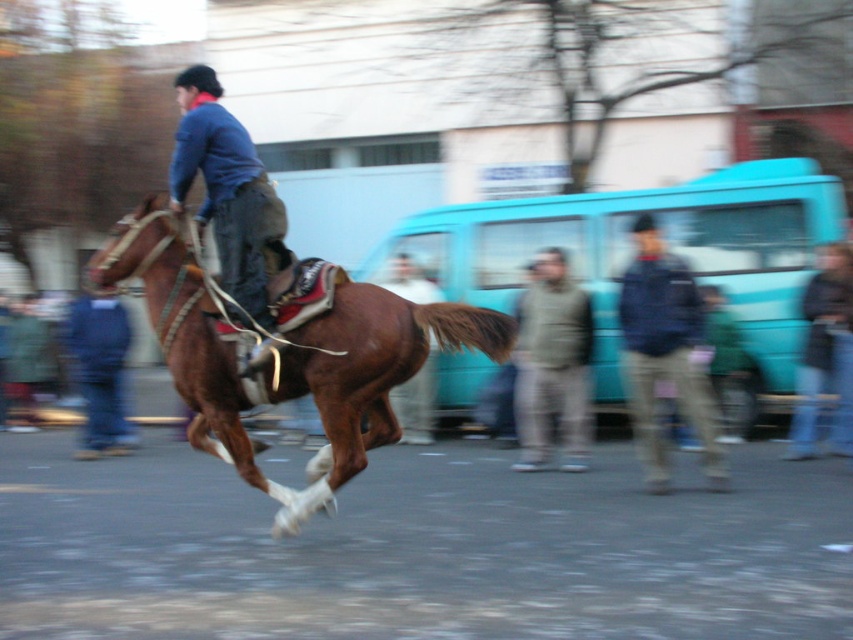
Question: Can you confirm if blue denim jacket at upper left is thinner than gray woolen jacket at center?

Choices:
 (A) yes
 (B) no

Answer: (A)

Question: Which object appears closest to the camera in this image?

Choices:
 (A) dark blue jacket at center
 (B) blue denim jacket at upper left

Answer: (B)

Question: Which object is closer to the camera taking this photo?

Choices:
 (A) gray woolen jacket at center
 (B) blue denim jacket at upper left
 (C) brown glossy horse at center
 (D) dark blue jacket at center

Answer: (C)

Question: Is brown glossy horse at center to the right of dark blue jacket at center from the viewer's perspective?

Choices:
 (A) yes
 (B) no

Answer: (B)

Question: Among these objects, which one is nearest to the camera?

Choices:
 (A) blue denim jacket at upper left
 (B) dark blue jacket at center
 (C) gray woolen jacket at center
 (D) brown glossy horse at center

Answer: (D)

Question: Can you confirm if brown glossy horse at center is positioned to the right of gray woolen jacket at center?

Choices:
 (A) yes
 (B) no

Answer: (B)